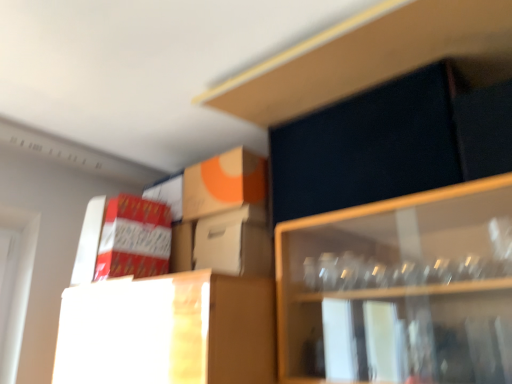
Question: Does white cardboard box at center, marked as the 3th cardboard box in a left-to-right arrangement, have a smaller size compared to dark matte cabinet at upper right?

Choices:
 (A) yes
 (B) no

Answer: (A)

Question: Is white cardboard box at center, marked as the 3th cardboard box in a left-to-right arrangement, facing away from dark matte cabinet at upper right?

Choices:
 (A) no
 (B) yes

Answer: (A)

Question: Is white cardboard box at center, marked as the 3th cardboard box in a left-to-right arrangement, positioned behind dark matte cabinet at upper right?

Choices:
 (A) no
 (B) yes

Answer: (B)

Question: Considering the relative positions of white cardboard box at center, which appears as the first cardboard box when viewed from the right, and dark matte cabinet at upper right in the image provided, is white cardboard box at center, which appears as the first cardboard box when viewed from the right, to the left of dark matte cabinet at upper right from the viewer's perspective?

Choices:
 (A) no
 (B) yes

Answer: (B)

Question: Does white cardboard box at center, marked as the 3th cardboard box in a left-to-right arrangement, have a greater height compared to dark matte cabinet at upper right?

Choices:
 (A) yes
 (B) no

Answer: (A)

Question: Is point (119, 213) positioned closer to the camera than point (275, 67)?

Choices:
 (A) farther
 (B) closer

Answer: (A)

Question: From a real-world perspective, is red cardboard box at left, placed as the 3th cardboard box when sorted from right to left, positioned above or below dark matte cabinet at upper right?

Choices:
 (A) below
 (B) above

Answer: (A)

Question: Considering the positions of red cardboard box at left, placed as the 3th cardboard box when sorted from right to left, and dark matte cabinet at upper right in the image, is red cardboard box at left, placed as the 3th cardboard box when sorted from right to left, taller or shorter than dark matte cabinet at upper right?

Choices:
 (A) short
 (B) tall

Answer: (B)

Question: Considering their positions, is red cardboard box at left, the first cardboard box viewed from the left, located in front of or behind dark matte cabinet at upper right?

Choices:
 (A) front
 (B) behind

Answer: (B)

Question: Considering their positions, is orange matte cardboard box at upper center, which is the second cardboard box in right-to-left order, located in front of or behind red cardboard box at left, the first cardboard box viewed from the left?

Choices:
 (A) front
 (B) behind

Answer: (B)

Question: Based on their sizes in the image, would you say orange matte cardboard box at upper center, which is the second cardboard box in right-to-left order, is bigger or smaller than red cardboard box at left, placed as the 3th cardboard box when sorted from right to left?

Choices:
 (A) small
 (B) big

Answer: (B)

Question: From the image's perspective, is orange matte cardboard box at upper center, placed as the 2th cardboard box when sorted from left to right, located above or below red cardboard box at left, placed as the 3th cardboard box when sorted from right to left?

Choices:
 (A) above
 (B) below

Answer: (A)

Question: Considering the relative positions of orange matte cardboard box at upper center, placed as the 2th cardboard box when sorted from left to right, and red cardboard box at left, placed as the 3th cardboard box when sorted from right to left, in the image provided, is orange matte cardboard box at upper center, placed as the 2th cardboard box when sorted from left to right, to the left or to the right of red cardboard box at left, placed as the 3th cardboard box when sorted from right to left,?

Choices:
 (A) right
 (B) left

Answer: (A)

Question: Based on their positions, is dark matte cabinet at upper right located to the left or right of white cardboard box at center, marked as the 3th cardboard box in a left-to-right arrangement?

Choices:
 (A) left
 (B) right

Answer: (B)

Question: Is dark matte cabinet at upper right in front of or behind white cardboard box at center, marked as the 3th cardboard box in a left-to-right arrangement, in the image?

Choices:
 (A) behind
 (B) front

Answer: (B)